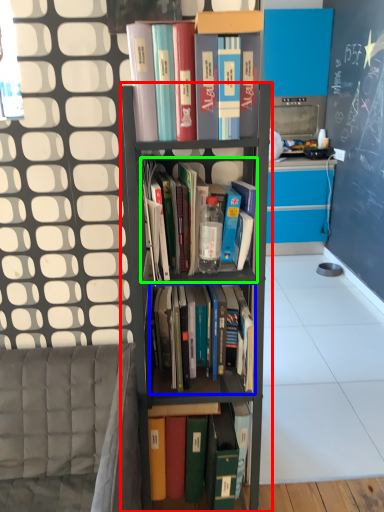
Question: Which object is positioned closest to shelf (highlighted by a red box)? Select from book (highlighted by a blue box) and book (highlighted by a green box).

Choices:
 (A) book
 (B) book

Answer: (A)